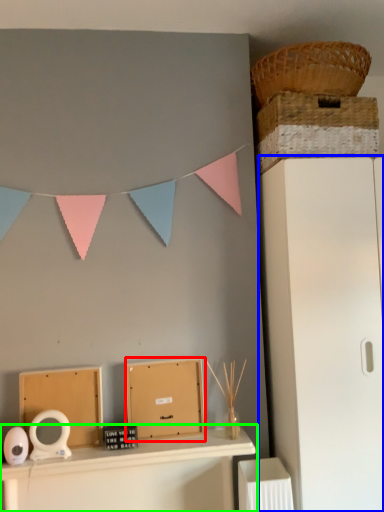
Question: Which object is the farthest from cardboard box (highlighted by a red box)? Choose among these: file cabinet (highlighted by a blue box) or furniture (highlighted by a green box).

Choices:
 (A) file cabinet
 (B) furniture

Answer: (A)